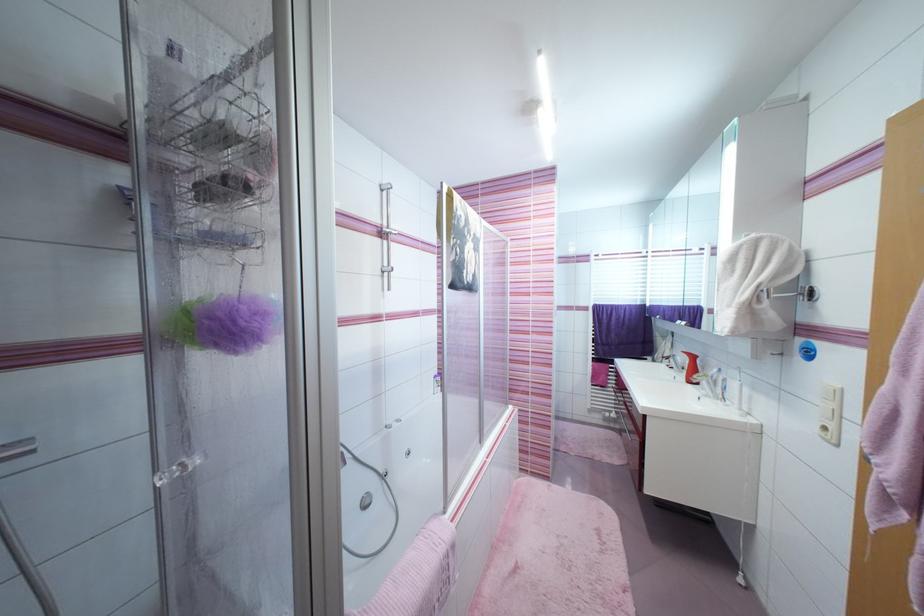
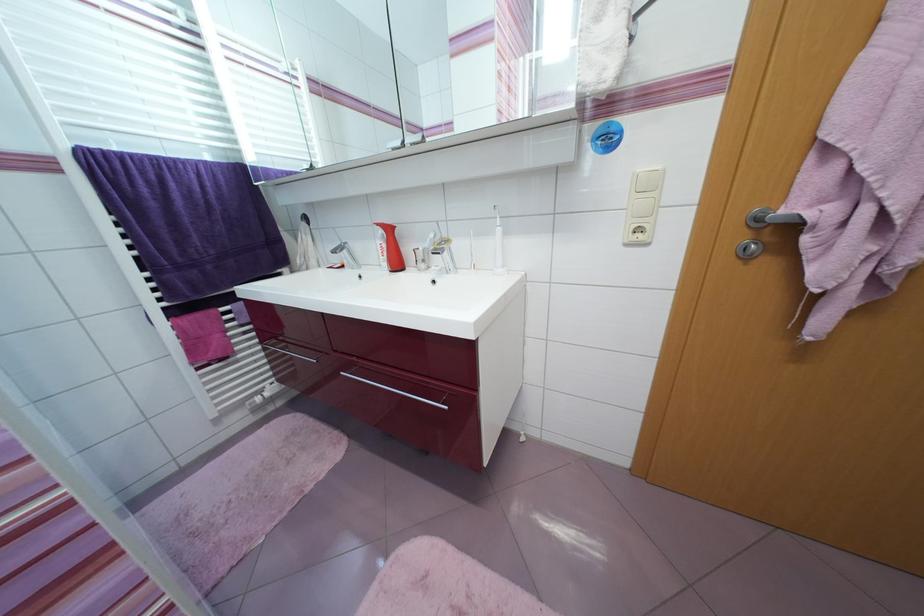
Find the pixel in the second image that matches point 672,360 in the first image.

(338, 254)